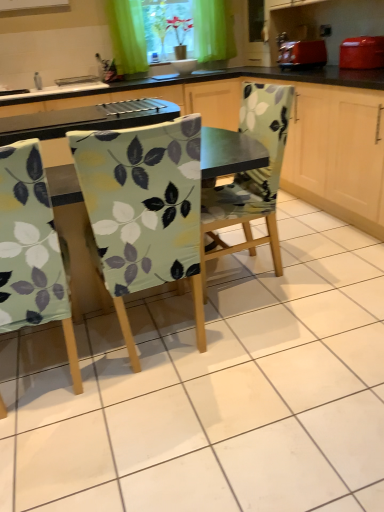
The height and width of the screenshot is (512, 384). Describe the element at coordinates (362, 53) in the screenshot. I see `matte red toaster at upper right` at that location.

Measure the distance between matte red toaster at upper right and camera.

They are 9.78 feet apart.

What is the approximate height of green fabric at upper center?

It is 21.49 inches.

Find the location of a particular element. The height and width of the screenshot is (512, 384). light green fabric-covered chair at center, the second chair in the left-to-right sequence is located at coordinates (143, 210).

Measure the distance between light green fabric-covered chair at center, the second chair in the left-to-right sequence, and camera.

light green fabric-covered chair at center, the second chair in the left-to-right sequence, is 1.30 meters away from camera.

This screenshot has width=384, height=512. Describe the element at coordinates (56, 85) in the screenshot. I see `white glossy sink at upper left, placed as the first sink when sorted from bottom to top` at that location.

Locate an element on the screen. matte red toaster at upper right is located at coordinates (362, 53).

From the image's perspective, would you say floral fabric chair at center, acting as the third chair starting from the left, is positioned over light green fabric chair at left, which appears as the first chair when viewed from the left?

Correct, floral fabric chair at center, acting as the third chair starting from the left, appears higher than light green fabric chair at left, which appears as the first chair when viewed from the left, in the image.

Considering the sizes of objects floral fabric chair at center, acting as the third chair starting from the left, and light green fabric chair at left, placed as the 3th chair when sorted from right to left, in the image provided, who is shorter, floral fabric chair at center, acting as the third chair starting from the left, or light green fabric chair at left, placed as the 3th chair when sorted from right to left,?

floral fabric chair at center, acting as the third chair starting from the left, is shorter.

Are floral fabric chair at center, the first chair viewed from the right, and light green fabric chair at left, which appears as the first chair when viewed from the left, located far from each other?

No, there isn't a large distance between floral fabric chair at center, the first chair viewed from the right, and light green fabric chair at left, which appears as the first chair when viewed from the left.

Can you confirm if floral fabric chair at center, the first chair viewed from the right, is bigger than light green fabric chair at left, placed as the 3th chair when sorted from right to left?

Correct, floral fabric chair at center, the first chair viewed from the right, is larger in size than light green fabric chair at left, placed as the 3th chair when sorted from right to left.

Considering the relative sizes of green fabric at upper center and light green fabric chair at left, placed as the 3th chair when sorted from right to left, in the image provided, is green fabric at upper center wider than light green fabric chair at left, placed as the 3th chair when sorted from right to left,?

No.

Which object is further away from the camera taking this photo, green fabric at upper center or light green fabric chair at left, which appears as the first chair when viewed from the left?

green fabric at upper center.

From a real-world perspective, is green fabric at upper center over light green fabric chair at left, placed as the 3th chair when sorted from right to left?

Correct, in the physical world, green fabric at upper center is higher than light green fabric chair at left, placed as the 3th chair when sorted from right to left.

Considering the sizes of green fabric at upper center and light green fabric chair at left, placed as the 3th chair when sorted from right to left, in the image, is green fabric at upper center taller or shorter than light green fabric chair at left, placed as the 3th chair when sorted from right to left,?

In the image, green fabric at upper center appears to be shorter than light green fabric chair at left, placed as the 3th chair when sorted from right to left.

Is point (312, 62) closer or farther from the camera than point (174, 63)?

Point (312, 62) is closer to the camera than point (174, 63).

Can you confirm if matte red toaster at upper right is bigger than white glossy bowl at upper center, marked as the first sink in a top-to-bottom arrangement?

Indeed, matte red toaster at upper right has a larger size compared to white glossy bowl at upper center, marked as the first sink in a top-to-bottom arrangement.

From the image's perspective, which one is positioned lower, matte red toaster at upper right or white glossy bowl at upper center, marked as the first sink in a top-to-bottom arrangement?

From the image's view, matte red toaster at upper right is below.

Relative to white glossy bowl at upper center, marked as the first sink in a top-to-bottom arrangement, is matte red toaster at upper right in front or behind?

Visually, matte red toaster at upper right is located in front of white glossy bowl at upper center, marked as the first sink in a top-to-bottom arrangement.

Considering the points (155, 11) and (42, 82), which point is behind, point (155, 11) or point (42, 82)?

The point (155, 11) is farther from the camera.

Consider the image. Is the surface of green fabric at upper center in direct contact with white glossy sink at upper left, the 1th sink in the left-to-right sequence?

No, green fabric at upper center is not with white glossy sink at upper left, the 1th sink in the left-to-right sequence.

Is green fabric at upper center bigger or smaller than white glossy sink at upper left, the second sink in the right-to-left sequence?

green fabric at upper center is bigger than white glossy sink at upper left, the second sink in the right-to-left sequence.

How much distance is there between white glossy bowl at upper center, which is counted as the first sink, starting from the right, and light green fabric chair at left, placed as the 3th chair when sorted from right to left?

They are 9.66 feet apart.

Is white glossy bowl at upper center, which is counted as the first sink, starting from the right, completely or partially outside of light green fabric chair at left, placed as the 3th chair when sorted from right to left?

Indeed, white glossy bowl at upper center, which is counted as the first sink, starting from the right, is completely outside light green fabric chair at left, placed as the 3th chair when sorted from right to left.

Is white glossy bowl at upper center, marked as the first sink in a top-to-bottom arrangement, wider or thinner than light green fabric chair at left, which appears as the first chair when viewed from the left?

In the image, white glossy bowl at upper center, marked as the first sink in a top-to-bottom arrangement, appears to be more narrow than light green fabric chair at left, which appears as the first chair when viewed from the left.

Is point (208, 62) less distant than point (16, 203)?

No.

Is green fabric curtain at upper center at the right side of matte red toaster at upper right?

No, green fabric curtain at upper center is not to the right of matte red toaster at upper right.

From the image's perspective, is green fabric curtain at upper center positioned above or below matte red toaster at upper right?

Based on their image positions, green fabric curtain at upper center is located above matte red toaster at upper right.

Could you tell me if green fabric curtain at upper center is facing matte red toaster at upper right?

No, green fabric curtain at upper center is not turned towards matte red toaster at upper right.

Who is taller, white glossy bowl at upper center, marked as the first sink in a top-to-bottom arrangement, or green fabric chair at center?

green fabric chair at center is taller.

Is white glossy bowl at upper center, the 2th sink in the left-to-right sequence, in contact with green fabric chair at center?

There is a gap between white glossy bowl at upper center, the 2th sink in the left-to-right sequence, and green fabric chair at center.

Considering the positions of objects white glossy bowl at upper center, marked as the first sink in a top-to-bottom arrangement, and green fabric chair at center in the image provided, who is more to the left, white glossy bowl at upper center, marked as the first sink in a top-to-bottom arrangement, or green fabric chair at center?

Positioned to the left is white glossy bowl at upper center, marked as the first sink in a top-to-bottom arrangement.

From a real-world perspective, does white glossy bowl at upper center, marked as the first sink in a top-to-bottom arrangement, sit lower than green fabric chair at center?

Incorrect, from a real-world perspective, white glossy bowl at upper center, marked as the first sink in a top-to-bottom arrangement, is higher than green fabric chair at center.

Which chair is the 2nd one when counting from the front of the floral fabric chair at center, the first chair viewed from the right? Please provide its 2D coordinates.

[(31, 250)]

From a real-world perspective, which chair is the 1st one underneath the green fabric at upper center? Please provide its 2D coordinates.

[(31, 250)]

Looking at the image, which one is located closer to light green fabric-covered chair at center, the second chair in the left-to-right sequence, matte red toaster at upper right or white glossy sink at upper left, the second sink in the right-to-left sequence?

Among the two, matte red toaster at upper right is located nearer to light green fabric-covered chair at center, the second chair in the left-to-right sequence.

When comparing their distances from green fabric chair at center, does matte red toaster at upper right or light green fabric-covered chair at center, which appears as the second chair when viewed from the right, seem closer?

matte red toaster at upper right is positioned closer to the anchor green fabric chair at center.

Based on their spatial positions, is light green fabric chair at left, placed as the 3th chair when sorted from right to left, or green fabric curtain at upper center further from matte red toaster at upper right?

light green fabric chair at left, placed as the 3th chair when sorted from right to left, is positioned further to the anchor matte red toaster at upper right.

Which object lies nearer to the anchor point light green fabric chair at left, placed as the 3th chair when sorted from right to left, matte red toaster at upper right or floral fabric chair at center, acting as the third chair starting from the left?

floral fabric chair at center, acting as the third chair starting from the left, is positioned closer to the anchor light green fabric chair at left, placed as the 3th chair when sorted from right to left.

When comparing their distances from green fabric at upper center, does light green fabric chair at left, which appears as the first chair when viewed from the left, or matte red toaster at upper right seem closer?

Based on the image, matte red toaster at upper right appears to be nearer to green fabric at upper center.

Based on their spatial positions, is light green fabric chair at left, which appears as the first chair when viewed from the left, or green fabric at upper center further from floral fabric chair at center, the first chair viewed from the right?

green fabric at upper center lies further to floral fabric chair at center, the first chair viewed from the right, than the other object.

Looking at the image, which one is located closer to floral fabric chair at center, acting as the third chair starting from the left, matte red toaster at upper right or green fabric curtain at upper center?

matte red toaster at upper right lies closer to floral fabric chair at center, acting as the third chair starting from the left, than the other object.

Estimate the real-world distances between objects in this image. Which object is further from white glossy bowl at upper center, the 2th sink in the left-to-right sequence, matte red toaster at upper right or green fabric at upper center?

matte red toaster at upper right.

The height and width of the screenshot is (512, 384). I want to click on kitchen appliance between light green fabric chair at left, placed as the 3th chair when sorted from right to left, and matte red toaster at upper right, along the z-axis, so click(362, 53).

Locate an element on the screen. The image size is (384, 512). appliance located between green fabric chair at center and green fabric at upper center in the depth direction is located at coordinates (300, 53).

At what (x,y) coordinates should I click in order to perform the action: click on appliance located between light green fabric chair at left, placed as the 3th chair when sorted from right to left, and white glossy sink at upper left, the 1th sink in the left-to-right sequence, in the depth direction. Please return your answer as a coordinate pair (x, y). The height and width of the screenshot is (512, 384). Looking at the image, I should click on (300, 53).

Where is `kitchen appliance between light green fabric-covered chair at center, which appears as the second chair when viewed from the right, and matte red toaster at upper right in the front-back direction`? Image resolution: width=384 pixels, height=512 pixels. kitchen appliance between light green fabric-covered chair at center, which appears as the second chair when viewed from the right, and matte red toaster at upper right in the front-back direction is located at coordinates (362, 53).